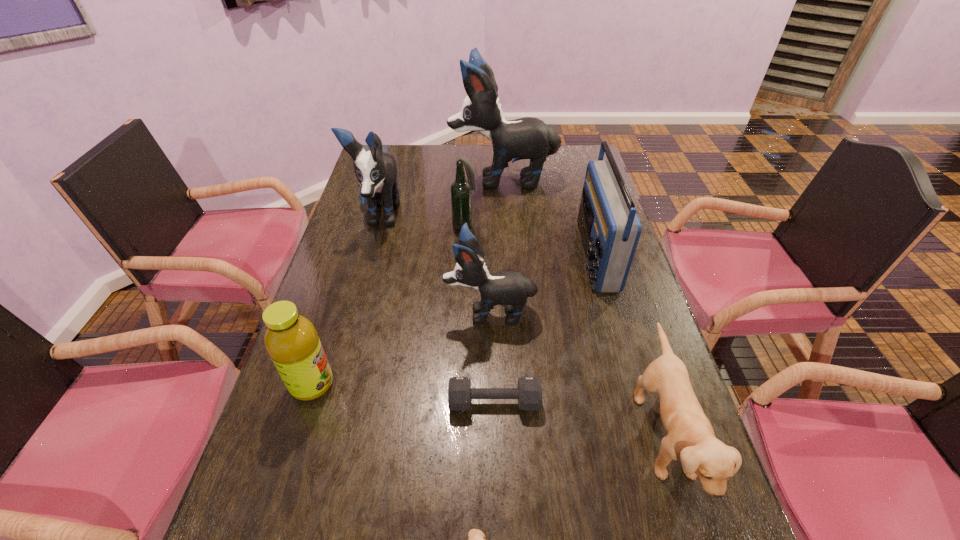
This screenshot has height=540, width=960. What are the coordinates of `puppy that is at the left edge` in the screenshot? It's located at (376, 171).

Where is `fruit juice at the left edge`? Image resolution: width=960 pixels, height=540 pixels. fruit juice at the left edge is located at coordinates (291, 340).

Locate an element on the screen. Image resolution: width=960 pixels, height=540 pixels. radio receiver that is at the right edge is located at coordinates (610, 229).

Where is `puppy present at the right edge`? This screenshot has height=540, width=960. puppy present at the right edge is located at coordinates (691, 439).

Locate an element on the screen. blank space at the far edge of the desktop is located at coordinates [x=490, y=162].

Locate an element on the screen. vacant region at the right edge is located at coordinates (645, 354).

In the image, there is a desktop. At what (x,y) coordinates should I click in order to perform the action: click on vacant space at the far right corner. Please return your answer as a coordinate pair (x, y). Looking at the image, I should click on (589, 159).

Image resolution: width=960 pixels, height=540 pixels. I want to click on unoccupied position between the fruit juice and the tallest puppy, so click(408, 282).

This screenshot has height=540, width=960. What are the coordinates of `vacant point located between the fruit juice and the blue radio receiver` in the screenshot? It's located at (453, 320).

You are a GUI agent. You are given a task and a screenshot of the screen. Output one action in this format:
    pyautogui.click(x=<x>, y=<y>)
    Task: Click on the free spot between the tallest object and the dark beer bottle
    The height and width of the screenshot is (540, 960).
    Given the screenshot: What is the action you would take?
    pyautogui.click(x=484, y=202)